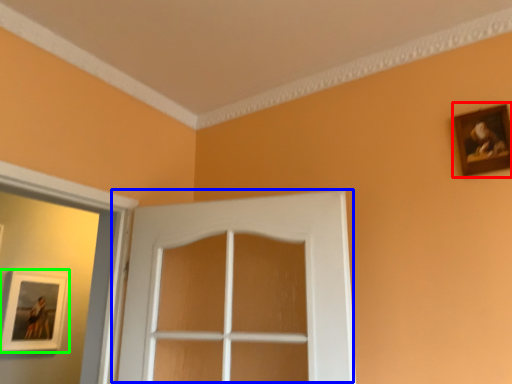
Question: Which is farther away from picture frame (highlighted by a red box)? door (highlighted by a blue box) or picture frame (highlighted by a green box)?

Choices:
 (A) door
 (B) picture frame

Answer: (B)